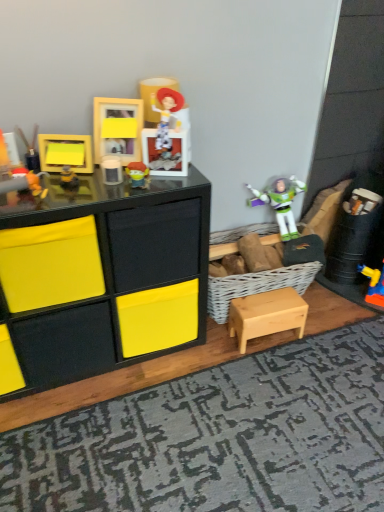
Where is `vacant space that's between yellow matte frame at upper left, the 3th toy when ordered from left to right, and matte black toy at left, marked as the 2th toy in a left-to-right arrangement`? vacant space that's between yellow matte frame at upper left, the 3th toy when ordered from left to right, and matte black toy at left, marked as the 2th toy in a left-to-right arrangement is located at coordinates (57, 181).